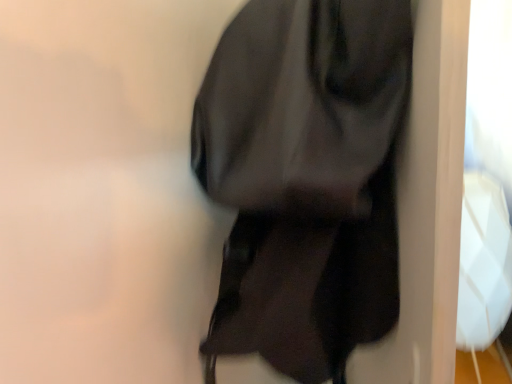
In order to face matte black scarf at center, should I rotate leftwards or rightwards?

Rotate your view right by about 5.025°.

Image resolution: width=512 pixels, height=384 pixels. What do you see at coordinates (305, 179) in the screenshot? I see `matte black scarf at center` at bounding box center [305, 179].

Where is `matte black scarf at center`? The height and width of the screenshot is (384, 512). matte black scarf at center is located at coordinates (305, 179).

Where is `matte black scarf at center`? The width and height of the screenshot is (512, 384). matte black scarf at center is located at coordinates (305, 179).